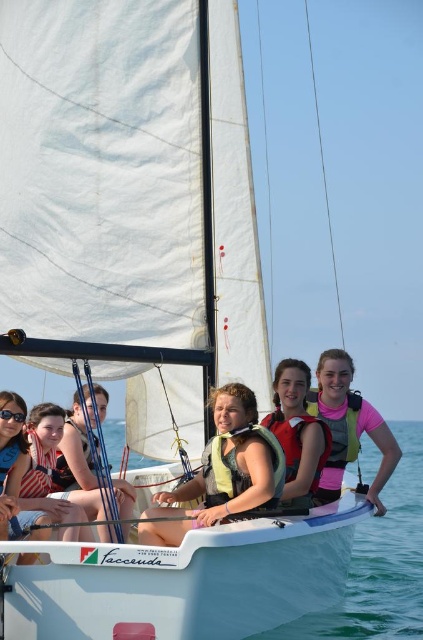
Which of these two, yellow life vest at center or matte yellow life jacket at center, stands shorter?

Standing shorter between the two is matte yellow life jacket at center.

Does yellow life vest at center come in front of matte yellow life jacket at center?

Yes, yellow life vest at center is in front of matte yellow life jacket at center.

Between point (164, 538) and point (271, 413), which one is positioned in front?

Positioned in front is point (164, 538).

Find the location of a particular element. The height and width of the screenshot is (640, 423). yellow life vest at center is located at coordinates (222, 472).

Does point (170, 522) come farther from viewer compared to point (332, 426)?

No.

Does yellow life vest at center have a lesser height compared to pink fabric life jacket at center?

No, yellow life vest at center is not shorter than pink fabric life jacket at center.

Who is more distant from viewer, [165,525] or [356,458]?

Point [356,458]

Find the location of `yellow life vest at center`. yellow life vest at center is located at coordinates (222, 472).

Is clear blue water at center positioned before matte yellow life jacket at center?

Yes.

Does point (408, 476) come closer to viewer compared to point (286, 472)?

No, it is behind (286, 472).

Identify the location of clear blue water at center. The height and width of the screenshot is (640, 423). (381, 563).